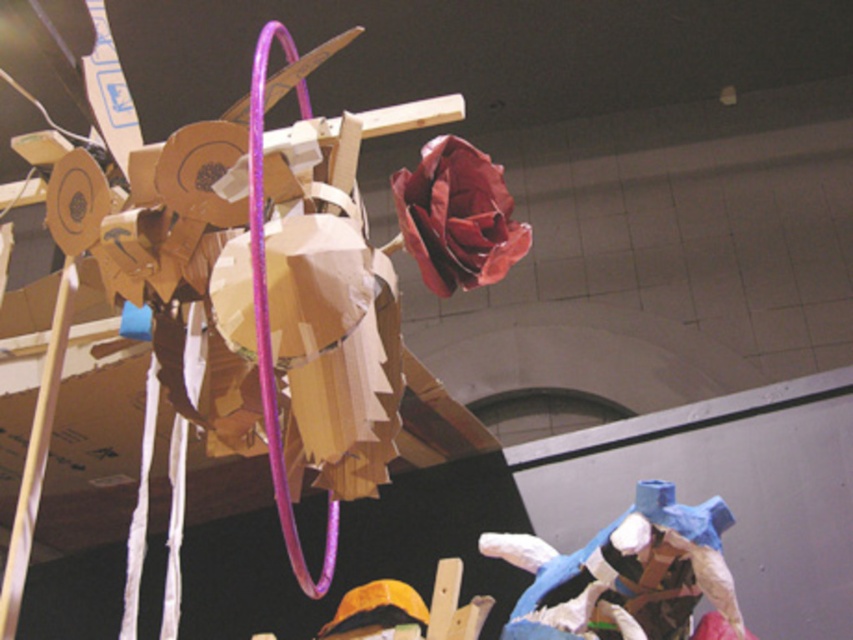
Question: Is blue paper mache figure at lower right below matte paper rose at upper center?

Choices:
 (A) yes
 (B) no

Answer: (A)

Question: Is blue paper mache figure at lower right positioned before matte paper rose at upper center?

Choices:
 (A) yes
 (B) no

Answer: (B)

Question: Which point is closer to the camera?

Choices:
 (A) (479, 266)
 (B) (598, 541)

Answer: (A)

Question: Is blue paper mache figure at lower right further to the viewer compared to matte paper rose at upper center?

Choices:
 (A) yes
 (B) no

Answer: (A)

Question: Which object is closer to the camera taking this photo?

Choices:
 (A) matte paper rose at upper center
 (B) blue paper mache figure at lower right

Answer: (A)